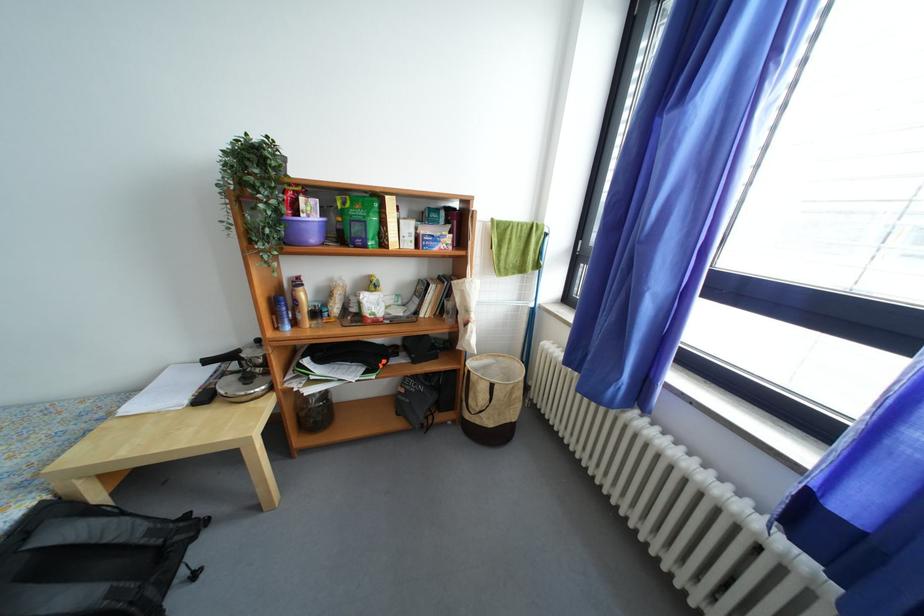
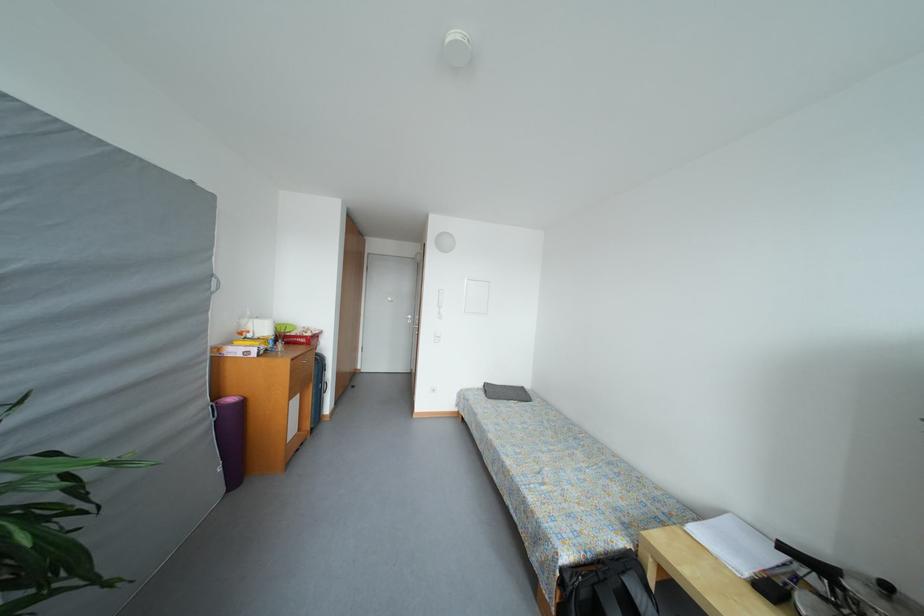
In the second image, find the point that corresponds to the point at 55,517 in the first image.

(638, 567)